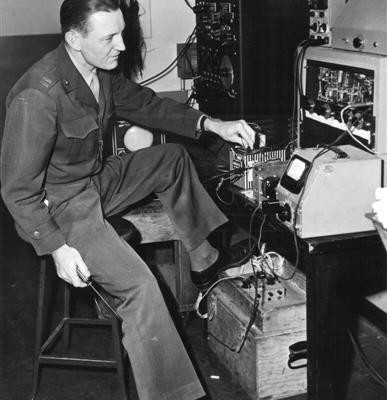
Where is `dark gray or black glossy flooring`? This screenshot has height=400, width=387. dark gray or black glossy flooring is located at coordinates (5, 331).